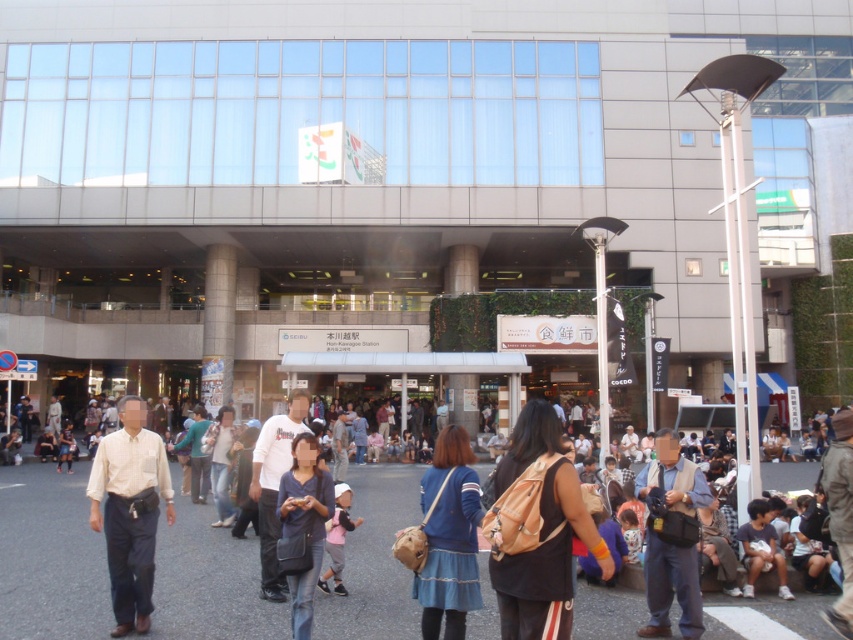
You are a photographer trying to capture a candid shot of two people wearing blue clothing in the crowd. The blue fabric dress at center and the blue denim jeans at center are both in your viewfinder. Based on their widths, which clothing item would you need to zoom out slightly to ensure both are fully visible in the frame?

The blue denim jeans at center is wider than the blue fabric dress at center, so you would need to zoom out slightly to ensure the blue denim jeans at center is fully visible in the frame.